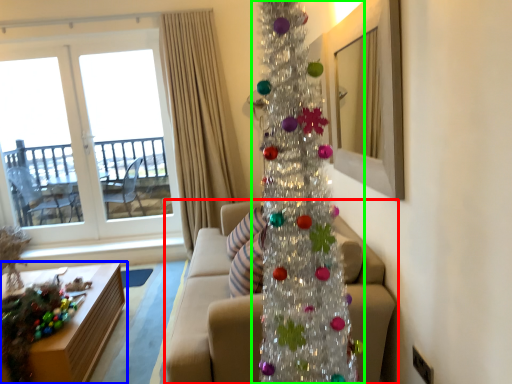
Question: Which is nearer to the studio couch (highlighted by a red box)? table (highlighted by a blue box) or christmas tree (highlighted by a green box).

Choices:
 (A) table
 (B) christmas tree

Answer: (B)